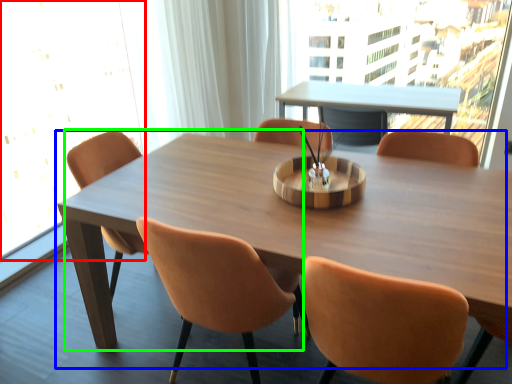
Question: Which object is the closest to the window screen (highlighted by a red box)? Choose among these: table (highlighted by a blue box) or chair (highlighted by a green box).

Choices:
 (A) table
 (B) chair

Answer: (B)